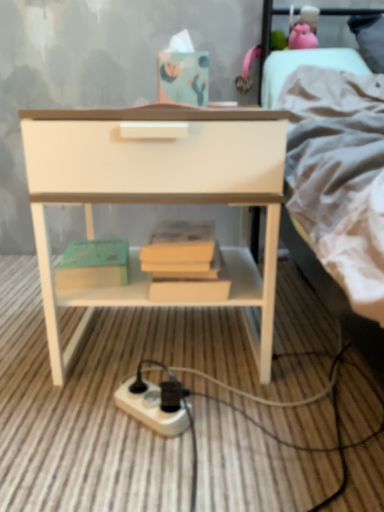
Question: Which direction should I rotate to look at white plastic power plugs and sockets at lower center?

Choices:
 (A) left
 (B) right

Answer: (A)

Question: Considering the relative sizes of light gray fabric bed at upper right and white plastic power plugs and sockets at lower center in the image provided, is light gray fabric bed at upper right wider than white plastic power plugs and sockets at lower center?

Choices:
 (A) yes
 (B) no

Answer: (A)

Question: Considering the relative sizes of light gray fabric bed at upper right and white plastic power plugs and sockets at lower center in the image provided, is light gray fabric bed at upper right taller than white plastic power plugs and sockets at lower center?

Choices:
 (A) no
 (B) yes

Answer: (B)

Question: Considering the relative sizes of light gray fabric bed at upper right and white plastic power plugs and sockets at lower center in the image provided, is light gray fabric bed at upper right smaller than white plastic power plugs and sockets at lower center?

Choices:
 (A) yes
 (B) no

Answer: (B)

Question: Is light gray fabric bed at upper right bigger than white plastic power plugs and sockets at lower center?

Choices:
 (A) yes
 (B) no

Answer: (A)

Question: From a real-world perspective, is light gray fabric bed at upper right located beneath white plastic power plugs and sockets at lower center?

Choices:
 (A) no
 (B) yes

Answer: (A)

Question: Does light gray fabric bed at upper right have a lesser width compared to white plastic power plugs and sockets at lower center?

Choices:
 (A) no
 (B) yes

Answer: (A)

Question: Can you confirm if white plastic power plugs and sockets at lower center is taller than white glossy nightstand at center?

Choices:
 (A) yes
 (B) no

Answer: (B)

Question: Is white plastic power plugs and sockets at lower center to the left of white glossy nightstand at center from the viewer's perspective?

Choices:
 (A) yes
 (B) no

Answer: (A)

Question: Is white plastic power plugs and sockets at lower center smaller than white glossy nightstand at center?

Choices:
 (A) no
 (B) yes

Answer: (B)

Question: From a real-world perspective, is white plastic power plugs and sockets at lower center on white glossy nightstand at center?

Choices:
 (A) no
 (B) yes

Answer: (A)

Question: From the image's perspective, is white plastic power plugs and sockets at lower center beneath white glossy nightstand at center?

Choices:
 (A) no
 (B) yes

Answer: (B)

Question: Is white glossy nightstand at center surrounded by white plastic power plugs and sockets at lower center?

Choices:
 (A) no
 (B) yes

Answer: (A)

Question: Does green matte paperback book at lower left come behind white glossy nightstand at center?

Choices:
 (A) no
 (B) yes

Answer: (B)